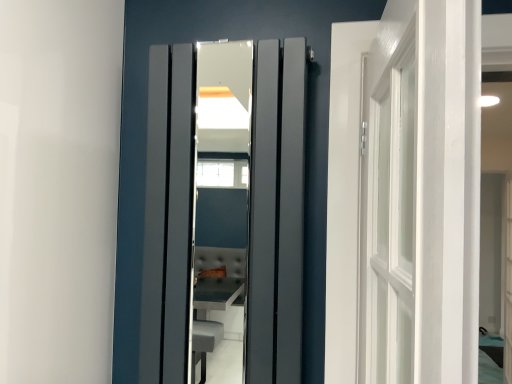
Describe the element at coordinates (507, 280) in the screenshot. This screenshot has height=384, width=512. I see `white glossy door at right` at that location.

What is the approximate width of white glossy door at right?

3.82 inches.

Measure the distance between point (505,238) and camera.

Point (505,238) is 3.80 meters from camera.

Locate an element on the screen. white glossy door at right is located at coordinates (x=507, y=280).

The width and height of the screenshot is (512, 384). What are the coordinates of `white glossy door at right` in the screenshot? It's located at (507, 280).